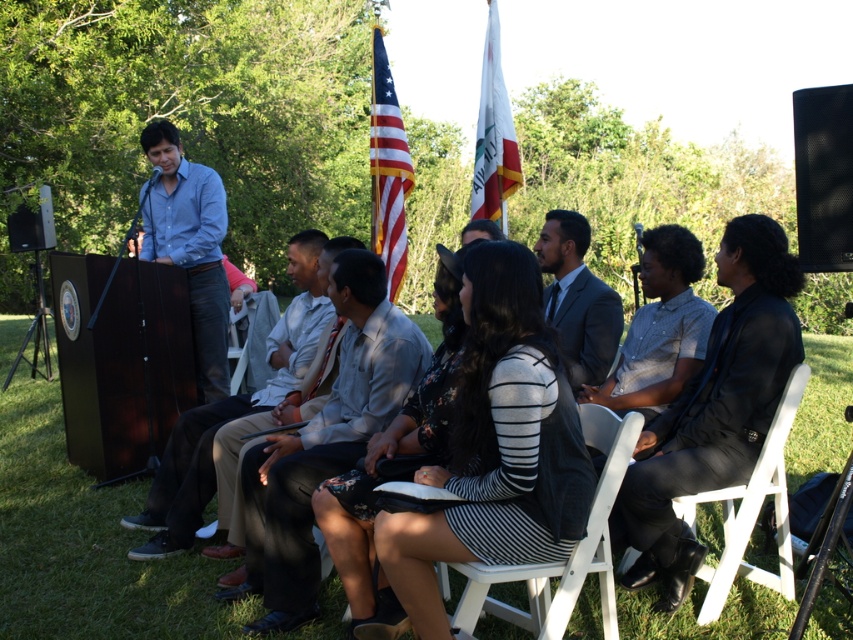
Question: Considering the relative positions of matte blue shirt at center and white wood chair at center in the image provided, where is matte blue shirt at center located with respect to white wood chair at center?

Choices:
 (A) below
 (B) above

Answer: (B)

Question: Can you confirm if light brown pants at center is wider than matte black suit at center?

Choices:
 (A) yes
 (B) no

Answer: (A)

Question: Which object is closer to the camera taking this photo?

Choices:
 (A) white fabric flag at center
 (B) light brown pants at center
 (C) matte black speaker at left
 (D) gray suit at center

Answer: (D)

Question: Which is farther from the matte blue shirt at center?

Choices:
 (A) white wood chair at lower right
 (B) american flag at center
 (C) light brown pants at center
 (D) black matte speaker at upper right

Answer: (D)

Question: Is gray suit jacket at center to the right of matte black speaker at left from the viewer's perspective?

Choices:
 (A) no
 (B) yes

Answer: (B)

Question: Considering the real-world distances, which object is farthest from the gray suit jacket at center?

Choices:
 (A) gray suit at center
 (B) white fabric flag at center

Answer: (B)